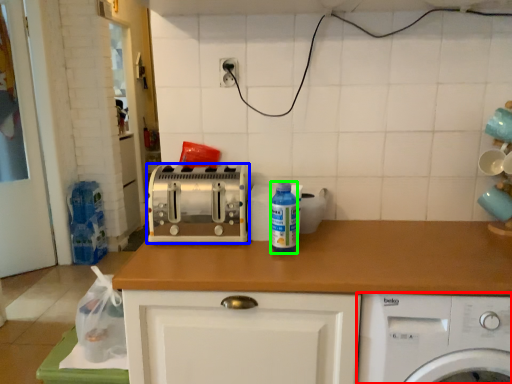
Question: Which object is positioned farthest from home appliance (highlighted by a red box)? Select from toaster (highlighted by a blue box) and bottle (highlighted by a green box).

Choices:
 (A) toaster
 (B) bottle

Answer: (A)